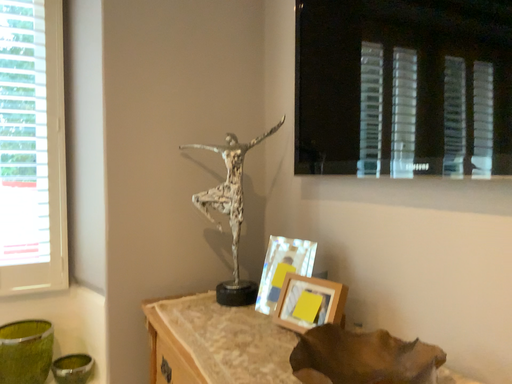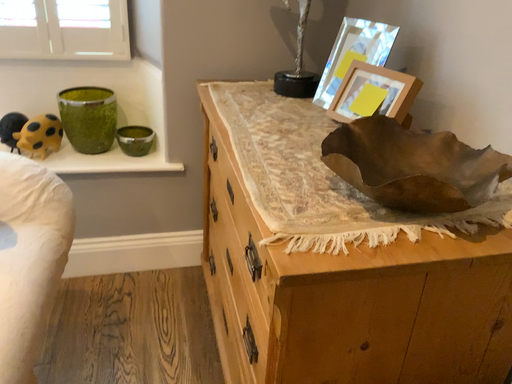
Question: How did the camera likely rotate when shooting the video?

Choices:
 (A) rotated right
 (B) rotated left

Answer: (B)